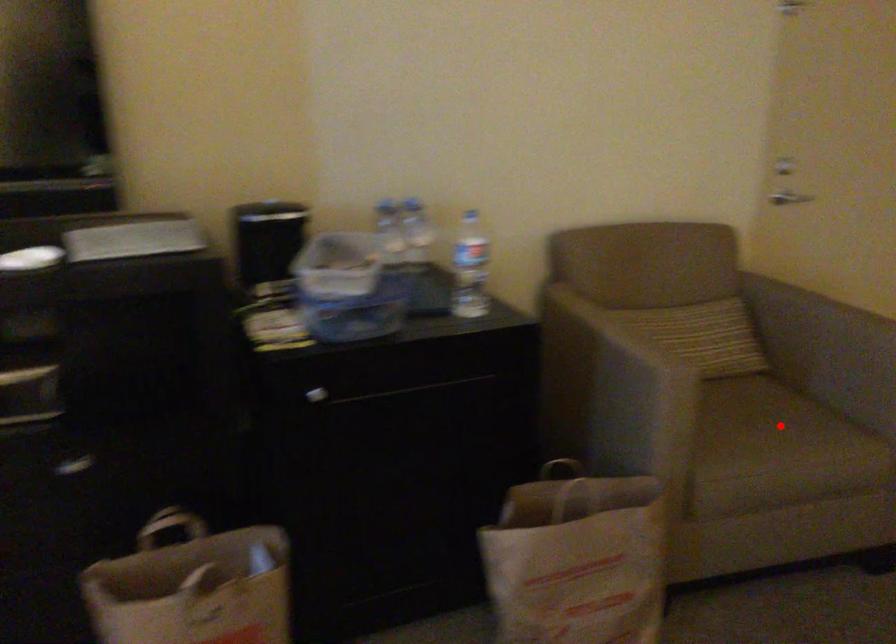
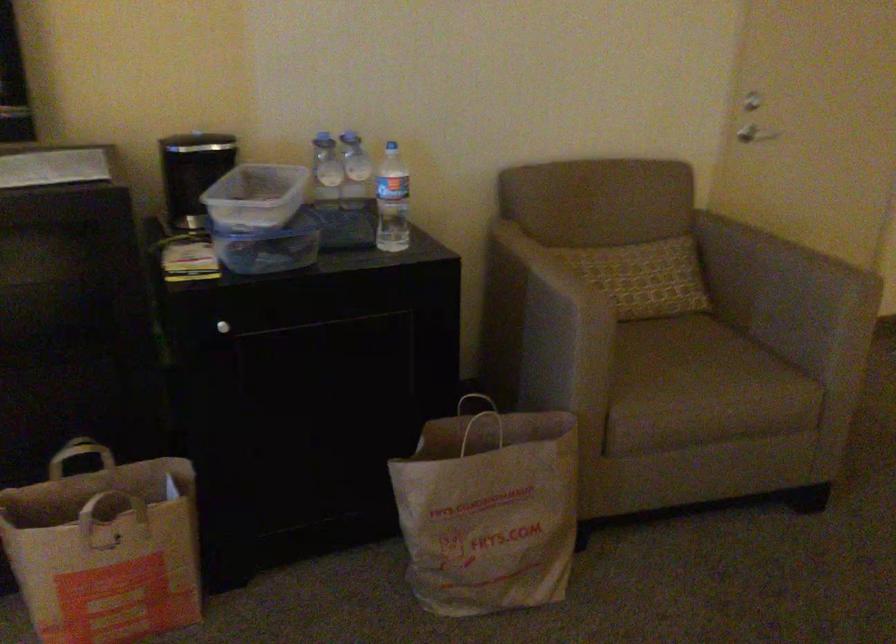
In the second image, find the point that corresponds to the highlighted location in the first image.

(707, 366)